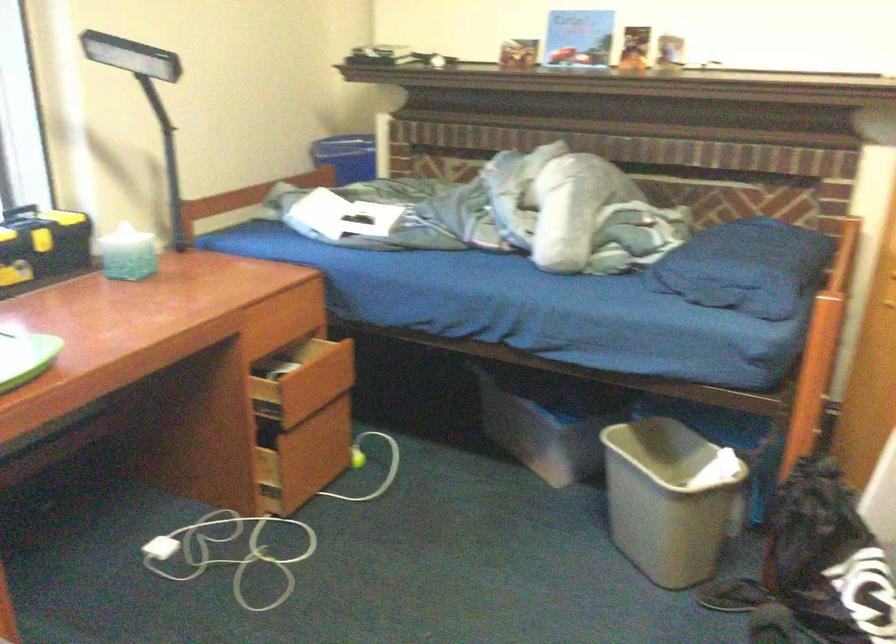
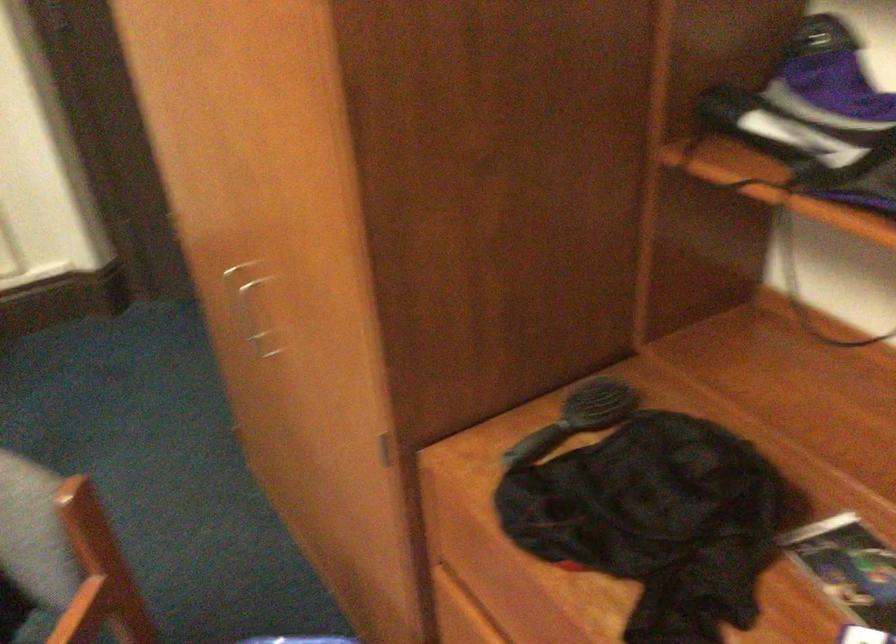
Based on the continuous images, in which direction is the camera rotating?

The camera rotated toward right-down.